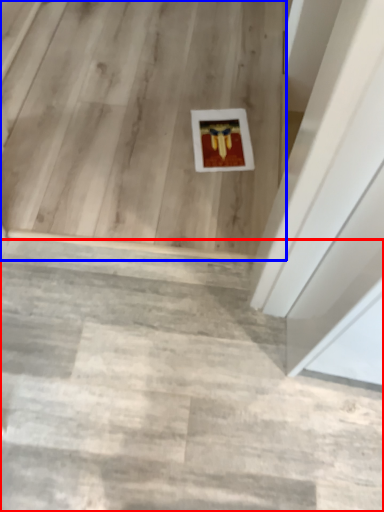
Question: Which point is closer to the camera, stairwell (highlighted by a red box) or stairwell (highlighted by a blue box)?

Choices:
 (A) stairwell
 (B) stairwell

Answer: (A)